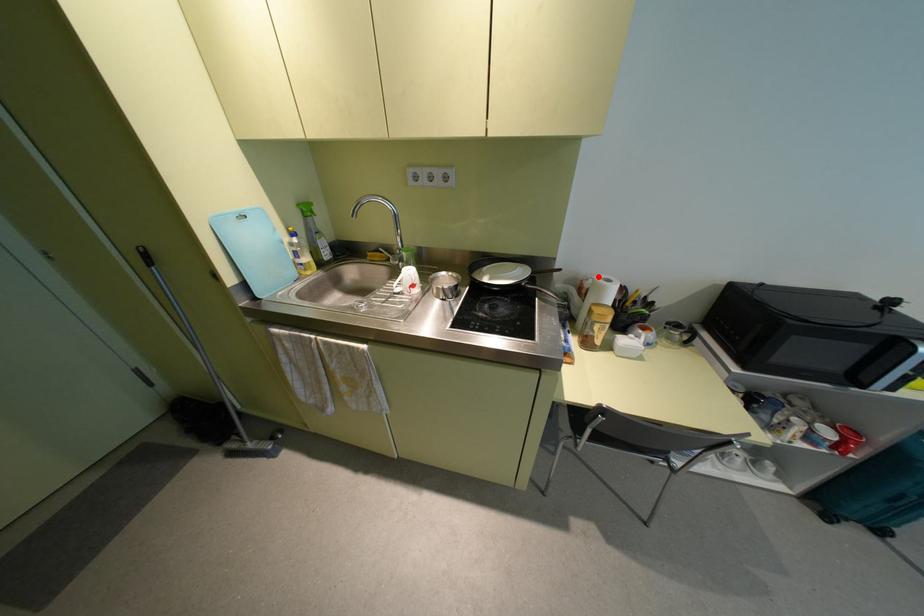
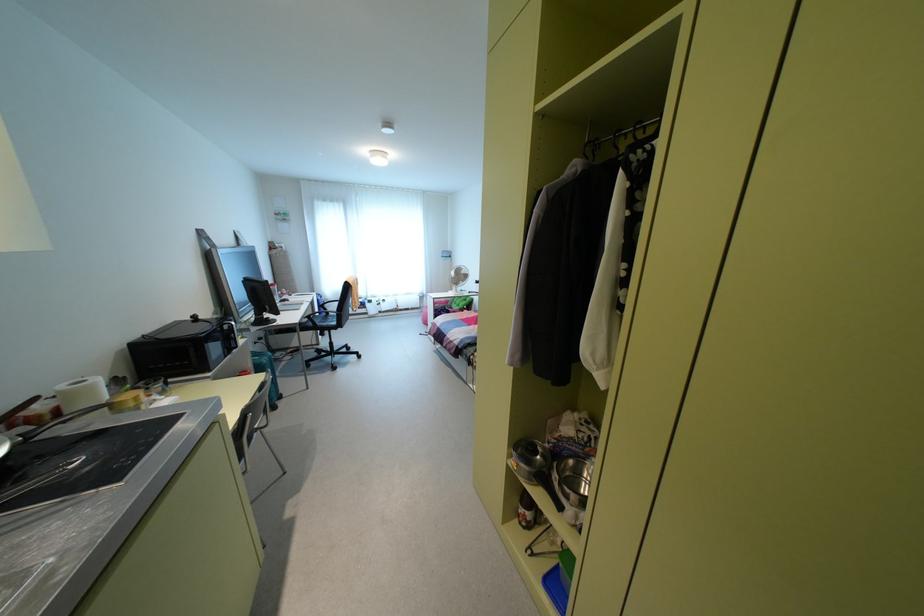
Where in the second image is the point corresponding to the highlighted location from the first image?

(62, 387)